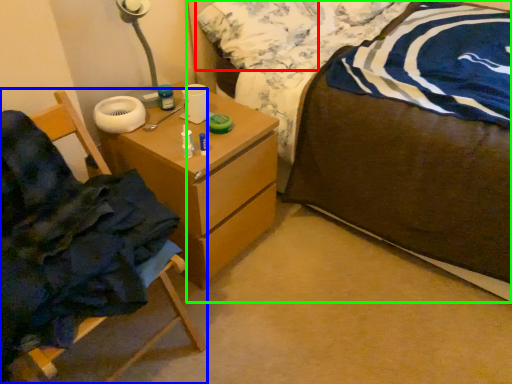
Question: Estimate the real-world distances between objects in this image. Which object is farther from pillow (highlighted by a red box), chair (highlighted by a blue box) or bed (highlighted by a green box)?

Choices:
 (A) chair
 (B) bed

Answer: (A)